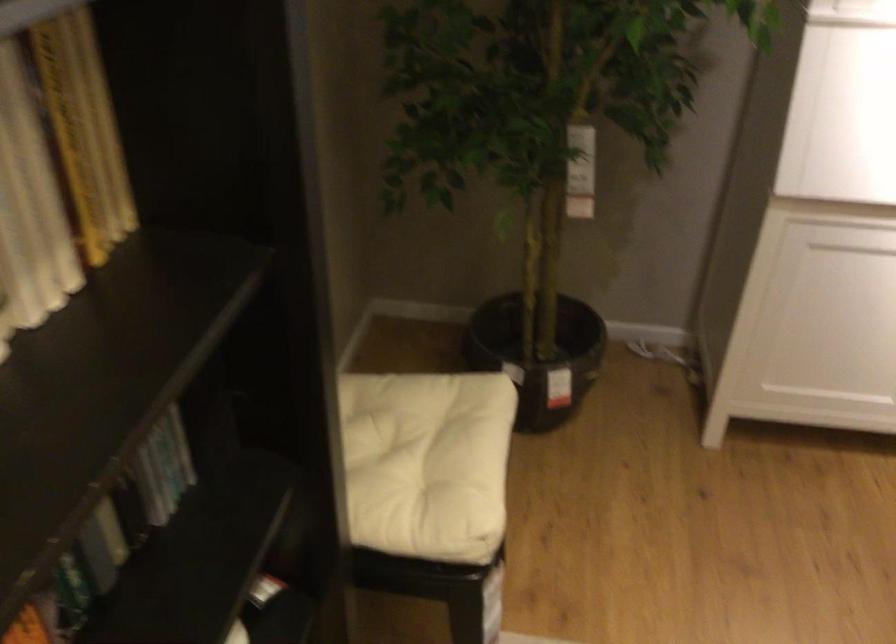
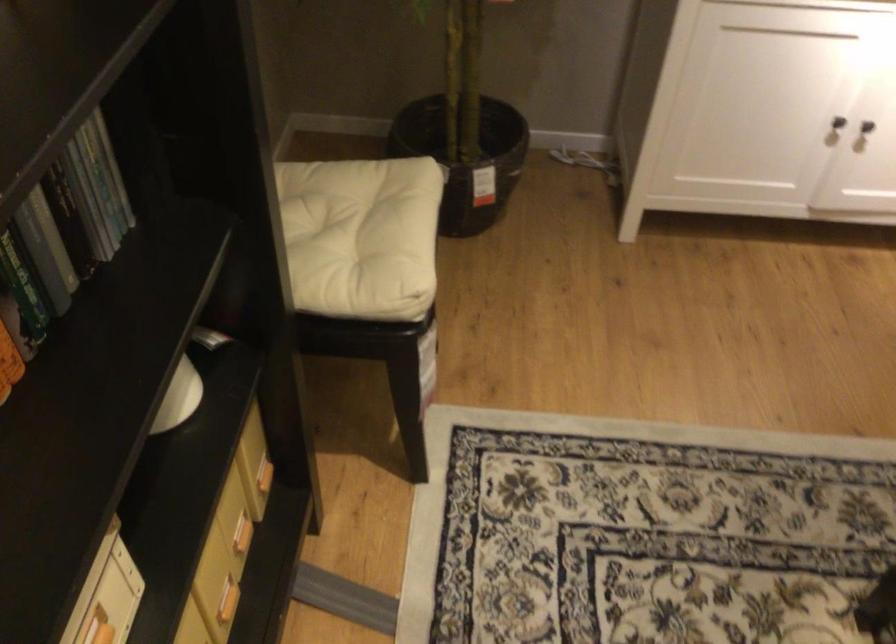
In the second image, find the point that corresponds to [152,460] in the first image.

(95, 198)